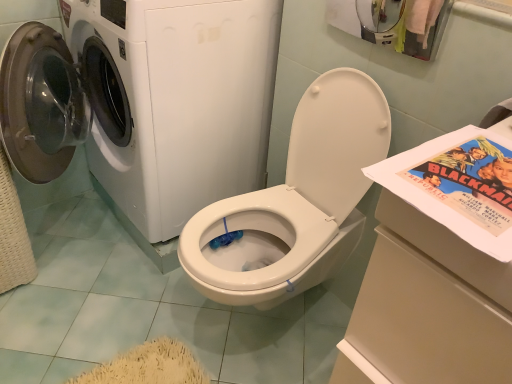
Question: Is the position of white glossy washing machine at left less distant than that of white glossy washer at upper left?

Choices:
 (A) no
 (B) yes

Answer: (A)

Question: From a real-world perspective, is white glossy washing machine at left located higher than white glossy washer at upper left?

Choices:
 (A) yes
 (B) no

Answer: (A)

Question: Considering the relative sizes of white glossy washing machine at left and white glossy washer at upper left in the image provided, is white glossy washing machine at left shorter than white glossy washer at upper left?

Choices:
 (A) no
 (B) yes

Answer: (A)

Question: Does white glossy washing machine at left have a greater width compared to white glossy washer at upper left?

Choices:
 (A) yes
 (B) no

Answer: (A)

Question: Is white glossy washing machine at left positioned far away from white glossy washer at upper left?

Choices:
 (A) no
 (B) yes

Answer: (A)

Question: From the image's perspective, is white glossy washing machine at left under white glossy washer at upper left?

Choices:
 (A) no
 (B) yes

Answer: (A)

Question: From a real-world perspective, is white glossy washer at upper left positioned under white glossy washing machine at left based on gravity?

Choices:
 (A) yes
 (B) no

Answer: (A)

Question: Is white glossy washer at upper left in front of white glossy washing machine at left?

Choices:
 (A) yes
 (B) no

Answer: (A)

Question: Is white glossy washer at upper left at the right side of white glossy washing machine at left?

Choices:
 (A) yes
 (B) no

Answer: (A)

Question: Does white glossy washer at upper left have a greater width compared to white glossy washing machine at left?

Choices:
 (A) yes
 (B) no

Answer: (B)

Question: Considering the relative sizes of white glossy washer at upper left and white glossy washing machine at left in the image provided, is white glossy washer at upper left thinner than white glossy washing machine at left?

Choices:
 (A) no
 (B) yes

Answer: (B)

Question: Is white glossy washer at upper left oriented away from white glossy washing machine at left?

Choices:
 (A) yes
 (B) no

Answer: (B)

Question: Is white glossy washer at upper left positioned with its back to matte paper comic book at right?

Choices:
 (A) yes
 (B) no

Answer: (B)